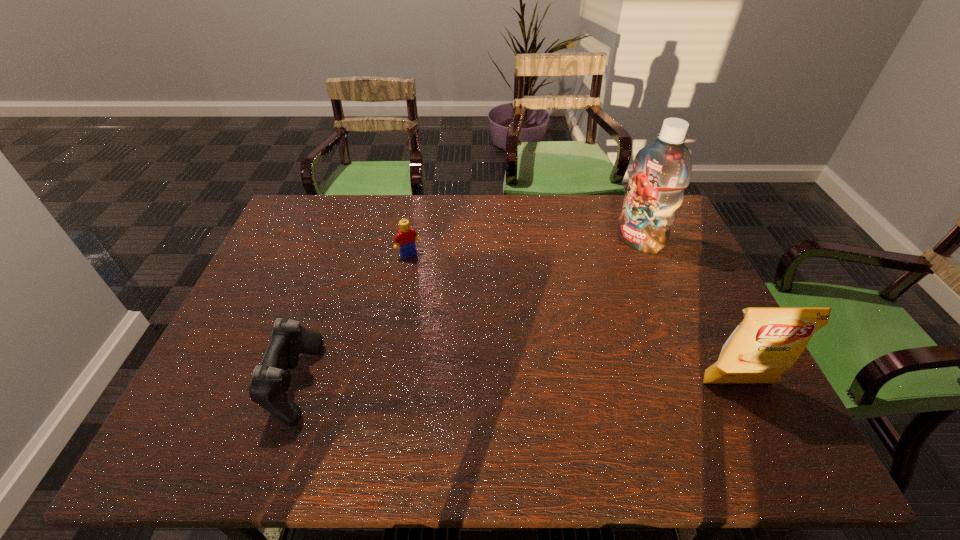
You are a GUI agent. You are given a task and a screenshot of the screen. Output one action in this format:
    pyautogui.click(x=<x>, y=<y>)
    Task: Click on the vacant region at the far edge
    
    Given the screenshot: What is the action you would take?
    pyautogui.click(x=615, y=220)

Locate an element on the screen. This screenshot has width=960, height=540. free space at the near edge of the desktop is located at coordinates (540, 406).

Image resolution: width=960 pixels, height=540 pixels. Find the location of `vacant space at the left edge of the desktop`. vacant space at the left edge of the desktop is located at coordinates (291, 316).

This screenshot has height=540, width=960. Find the location of `vacant area at the right edge`. vacant area at the right edge is located at coordinates (679, 253).

Locate an element on the screen. This screenshot has height=540, width=960. vacant space at the near left corner of the desktop is located at coordinates (228, 393).

I want to click on vacant space at the near right corner, so click(762, 389).

I want to click on vacant area that lies between the crisp (potato chip) and the shampoo, so click(688, 312).

Locate an element on the screen. free space between the control and the crisp (potato chip) is located at coordinates (516, 383).

The height and width of the screenshot is (540, 960). Find the location of `free point between the second tallest object and the leftmost object`. free point between the second tallest object and the leftmost object is located at coordinates (516, 383).

Locate an element on the screen. free space between the leftmost object and the tallest object is located at coordinates (467, 312).